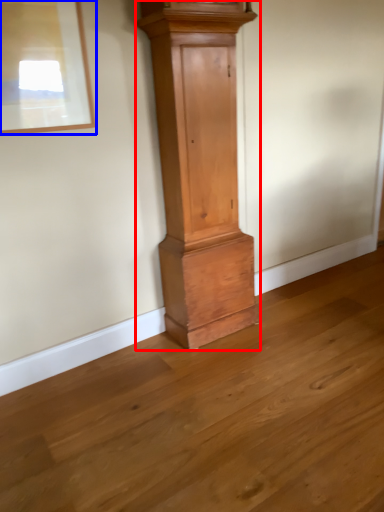
Question: Which of the following is the farthest to the observer, furniture (highlighted by a red box) or picture frame (highlighted by a blue box)?

Choices:
 (A) furniture
 (B) picture frame

Answer: (A)